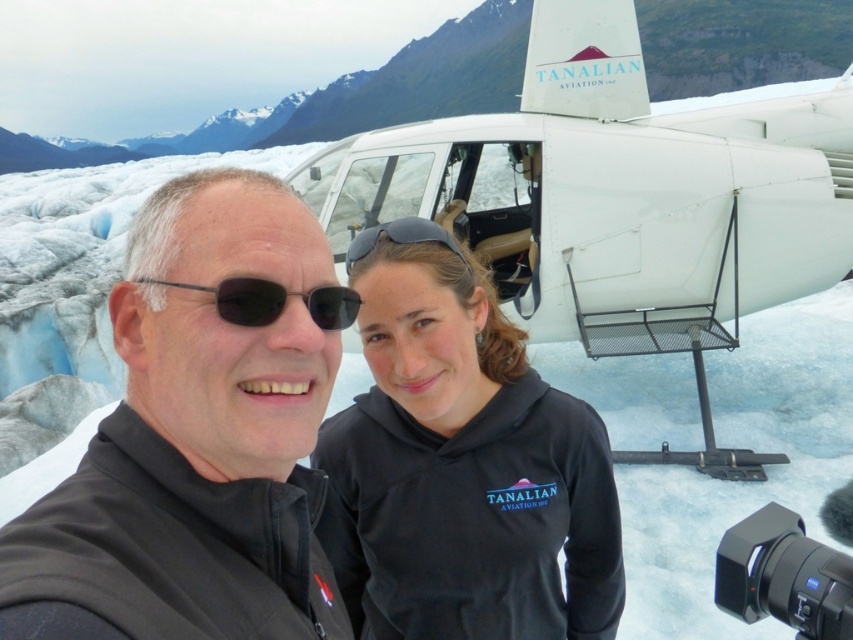
You are a photographer trying to capture the two people in the scene. Since both are wearing black jackets, you want to ensure you can distinguish between the black softshell jacket at center and the black fleece at center in your photo. Which one has a narrower silhouette?

The black softshell jacket at center is thinner than the black fleece at center, so the black softshell jacket at center has a narrower silhouette.

You are a photographer trying to capture a clear photo of the black softshell jacket at center and the black plastic sunglasses at left. Which object should you focus on first if you want to ensure both are in focus without adjusting your camera settings?

The black softshell jacket at center has a greater height compared to black plastic sunglasses at left, so focusing on the black softshell jacket at center first will ensure both are in focus since it is larger and closer to the camera.